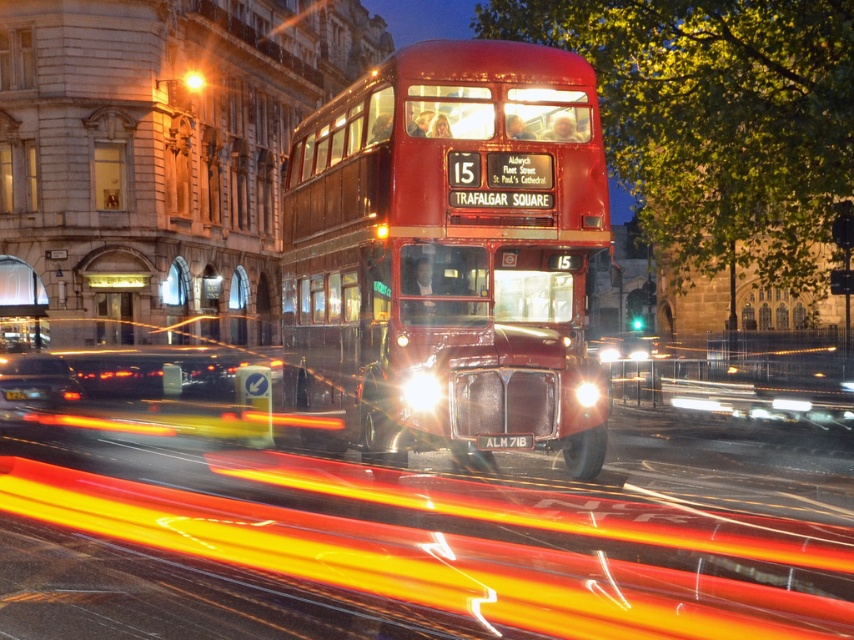
Question: Which point is closer to the camera taking this photo?

Choices:
 (A) (367, 136)
 (B) (19, 380)

Answer: (A)

Question: From the image, what is the correct spatial relationship of shiny red bus at center in relation to shiny black sedan at lower left?

Choices:
 (A) below
 (B) above

Answer: (A)

Question: Which object is farther from the camera taking this photo?

Choices:
 (A) shiny red bus at center
 (B) shiny black sedan at lower left
 (C) black plastic license plate at center

Answer: (B)

Question: Estimate the real-world distances between objects in this image. Which object is closer to the shiny red bus at center?

Choices:
 (A) shiny black sedan at lower left
 (B) black plastic license plate at center

Answer: (B)

Question: Can you confirm if shiny red bus at center is smaller than shiny black sedan at lower left?

Choices:
 (A) no
 (B) yes

Answer: (B)

Question: Considering the relative positions of shiny red bus at center and black plastic license plate at center in the image provided, where is shiny red bus at center located with respect to black plastic license plate at center?

Choices:
 (A) above
 (B) below

Answer: (B)